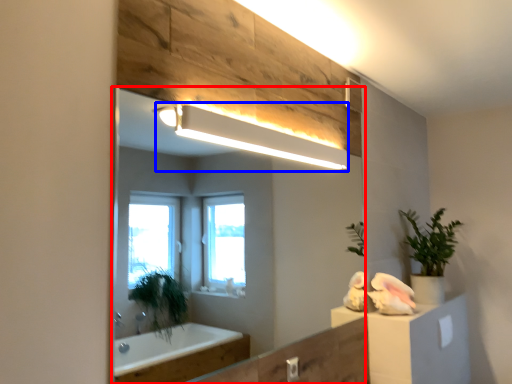
Question: Which object is further to the camera taking this photo, mirror (highlighted by a red box) or light fixture (highlighted by a blue box)?

Choices:
 (A) mirror
 (B) light fixture

Answer: (B)